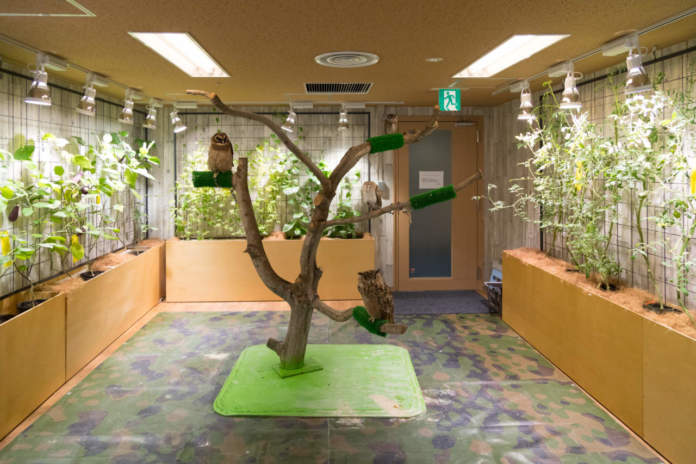
The height and width of the screenshot is (464, 696). Find the location of `floor`. floor is located at coordinates (484, 344).